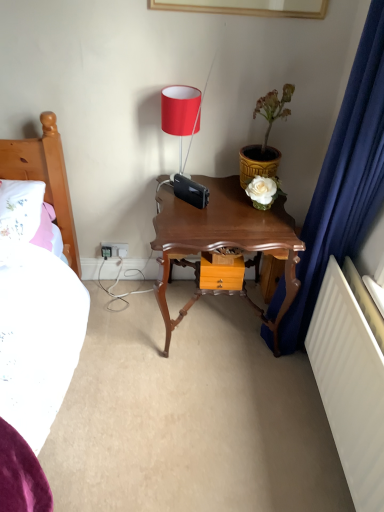
Question: Is yellow textured pot at upper right aimed at shiny brown wooden nightstand at center?

Choices:
 (A) no
 (B) yes

Answer: (A)

Question: Is yellow textured pot at upper right to the left of shiny brown wooden nightstand at center from the viewer's perspective?

Choices:
 (A) no
 (B) yes

Answer: (A)

Question: Does yellow textured pot at upper right touch shiny brown wooden nightstand at center?

Choices:
 (A) no
 (B) yes

Answer: (A)

Question: Is yellow textured pot at upper right looking in the opposite direction of shiny brown wooden nightstand at center?

Choices:
 (A) no
 (B) yes

Answer: (A)

Question: Does yellow textured pot at upper right come behind shiny brown wooden nightstand at center?

Choices:
 (A) no
 (B) yes

Answer: (B)

Question: Considering the positions of point (120, 248) and point (201, 279), is point (120, 248) closer or farther from the camera than point (201, 279)?

Choices:
 (A) closer
 (B) farther

Answer: (B)

Question: From the image's perspective, is white plastic electrical outlet at lower left positioned above or below wooden drawer at center?

Choices:
 (A) above
 (B) below

Answer: (A)

Question: Would you say white plastic electrical outlet at lower left is to the left or to the right of wooden drawer at center in the picture?

Choices:
 (A) left
 (B) right

Answer: (A)

Question: Considering their positions, is white plastic electrical outlet at lower left located in front of or behind wooden drawer at center?

Choices:
 (A) front
 (B) behind

Answer: (B)

Question: From a real-world perspective, relative to white plastic electrical outlet at lower left, is matte red lampshade at upper center vertically above or below?

Choices:
 (A) below
 (B) above

Answer: (B)

Question: From the image's perspective, relative to white plastic electrical outlet at lower left, is matte red lampshade at upper center above or below?

Choices:
 (A) below
 (B) above

Answer: (B)

Question: Is point (175, 100) positioned closer to the camera than point (125, 251)?

Choices:
 (A) closer
 (B) farther

Answer: (A)

Question: Looking at their shapes, would you say matte red lampshade at upper center is wider or thinner than white plastic electrical outlet at lower left?

Choices:
 (A) wide
 (B) thin

Answer: (A)

Question: From their relative heights in the image, would you say matte red lampshade at upper center is taller or shorter than yellow textured pot at upper right?

Choices:
 (A) tall
 (B) short

Answer: (B)

Question: Considering their positions, is matte red lampshade at upper center located in front of or behind yellow textured pot at upper right?

Choices:
 (A) front
 (B) behind

Answer: (B)